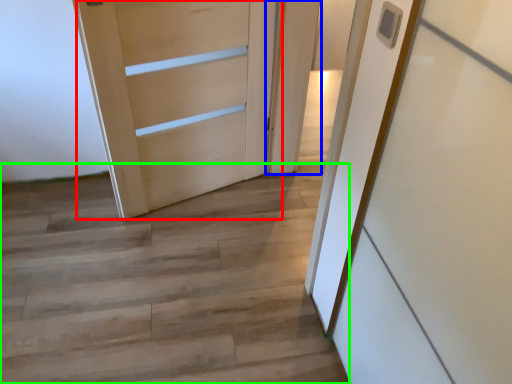
Question: Which is farther away from door (highlighted by a red box)? door (highlighted by a blue box) or stairwell (highlighted by a green box)?

Choices:
 (A) door
 (B) stairwell

Answer: (B)